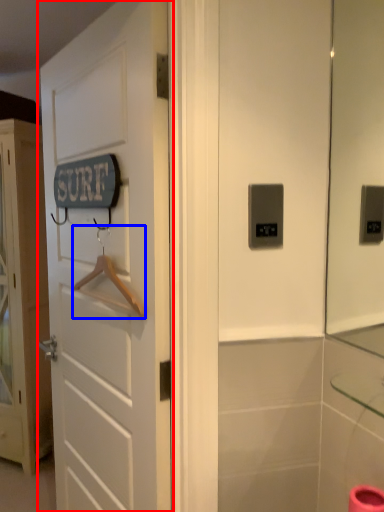
Question: Among these objects, which one is nearest to the camera, door (highlighted by a red box) or hanger (highlighted by a blue box)?

Choices:
 (A) door
 (B) hanger

Answer: (A)